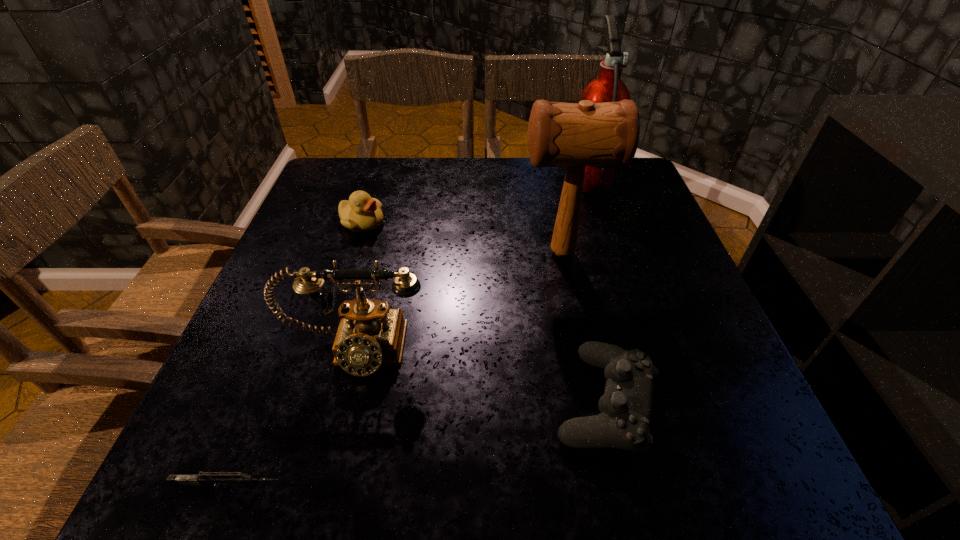
What are the coordinates of `telephone present at the left edge` in the screenshot? It's located at pos(371,334).

Where is `duckling located in the left edge section of the desktop`? Image resolution: width=960 pixels, height=540 pixels. duckling located in the left edge section of the desktop is located at coordinates (362, 213).

The height and width of the screenshot is (540, 960). Find the location of `gun at the left edge`. gun at the left edge is located at coordinates (218, 478).

Locate an element on the screen. Image resolution: width=960 pixels, height=540 pixels. fire extinguisher at the right edge is located at coordinates (608, 87).

This screenshot has height=540, width=960. In order to click on control located in the right edge section of the desktop in this screenshot , I will do `click(625, 408)`.

In order to click on object situated at the near left corner in this screenshot , I will do `click(218, 478)`.

Locate an element on the screen. This screenshot has height=540, width=960. object at the far right corner is located at coordinates (608, 87).

Locate an element on the screen. Image resolution: width=960 pixels, height=540 pixels. object that is at the near right corner is located at coordinates (625, 408).

In the image, there is a desktop. Where is `vacant space at the far edge`? This screenshot has height=540, width=960. vacant space at the far edge is located at coordinates (384, 158).

Locate an element on the screen. This screenshot has width=960, height=540. vacant space at the near edge of the desktop is located at coordinates (444, 458).